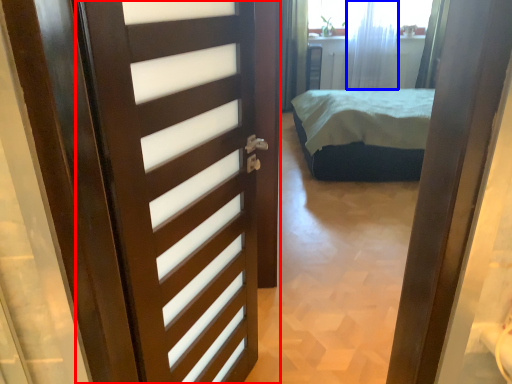
Question: Which object is closer to the camera taking this photo, door (highlighted by a red box) or curtain (highlighted by a blue box)?

Choices:
 (A) door
 (B) curtain

Answer: (A)